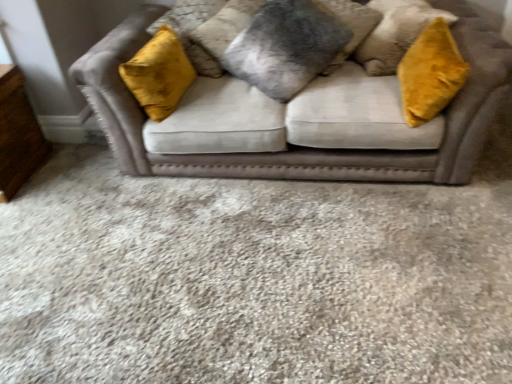
Question: From a real-world perspective, is velvet beige sofa at center positioned above or below fuzzy gray pillow at center, which is the second pillow in right-to-left order?

Choices:
 (A) below
 (B) above

Answer: (A)

Question: Is velvet beige sofa at center inside or outside of fuzzy gray pillow at center, which is the second pillow in right-to-left order?

Choices:
 (A) inside
 (B) outside

Answer: (B)

Question: Estimate the real-world distances between objects in this image. Which object is farther from the wooden dresser at lower left?

Choices:
 (A) velvet beige couch at center
 (B) fuzzy gray pillow at center, which is the second pillow in right-to-left order
 (C) velvet gray pillow at center, the first pillow viewed from the right
 (D) velvet beige sofa at center

Answer: (C)

Question: Which of these objects is positioned closest to the velvet beige sofa at center?

Choices:
 (A) velvet gray pillow at center, the first pillow viewed from the right
 (B) velvet beige couch at center
 (C) wooden dresser at lower left
 (D) fuzzy gray pillow at center, which ranks as the first pillow in left-to-right order

Answer: (B)